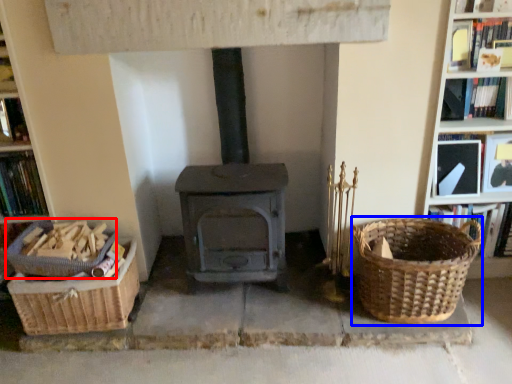
Question: Which of the following is the farthest to the observer, basket (highlighted by a red box) or basket (highlighted by a blue box)?

Choices:
 (A) basket
 (B) basket

Answer: (A)